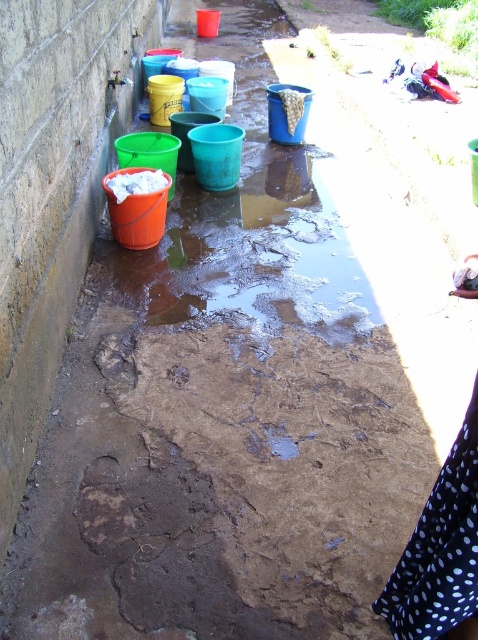
You are standing at the entrance of the utility area and see the shiny plastic buckets at left. What are their exact coordinates?

The shiny plastic buckets at left are located at coordinates point (249, 220).

You are a delivery person who needs to place a large box on the concrete path. The shiny plastic buckets at left and the black dotted fabric at lower right are in the way. Which object should you move to make more space?

You should move the shiny plastic buckets at left because it is larger in size than the black dotted fabric at lower right, so moving it will free up more space.

You are a gardener who needs to move a heavy tool from the shiny plastic buckets at left to the black dotted fabric at lower right. Which object should you move the tool to first to ensure it is closer to the destination?

The shiny plastic buckets at left is positioned on the left side of black dotted fabric at lower right, so you should move the tool to the shiny plastic buckets at left first as it is closer to the destination.